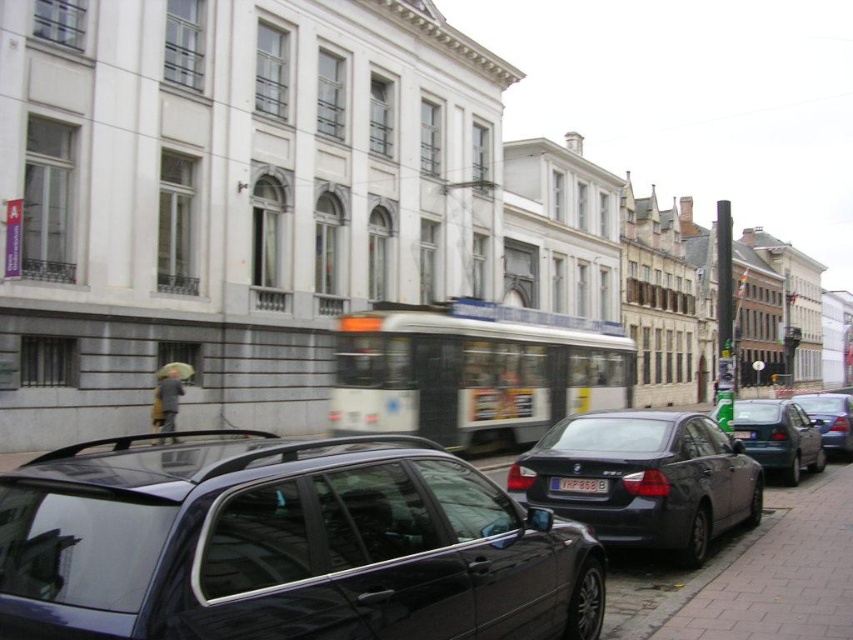
In the scene shown: You are standing at the tram in the center of the urban street scene. There is a point marked at coordinates [285,545]. Can you tell me what object this point is located on?

The point at coordinates [285,545] is located on the shiny black car at center.

You are a pedestrian standing on the brick pavement at lower right and want to cross the street to reach the tram. Is the metallic silver sedan at center blocking your path?

The brick pavement at lower right is to the left of the metallic silver sedan at center, so the sedan is positioned to the right of the pavement. Therefore, the metallic silver sedan at center is blocking your path to the tram.